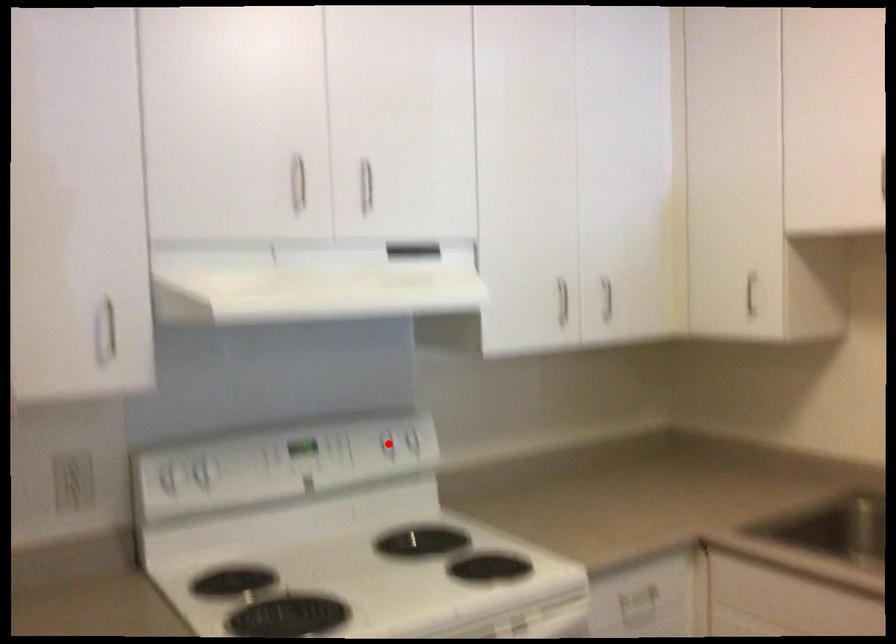
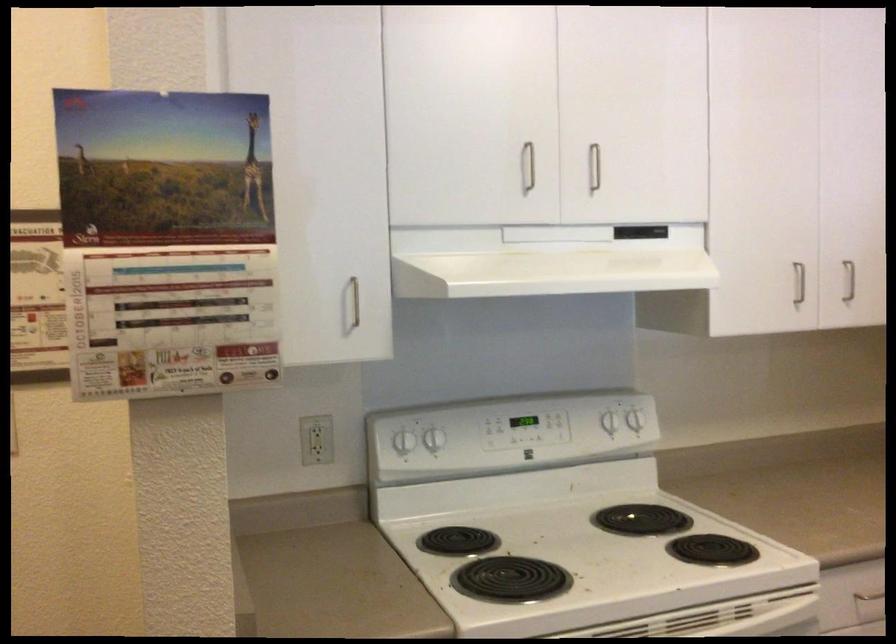
In the second image, find the point that corresponds to the highlighted location in the first image.

(608, 422)